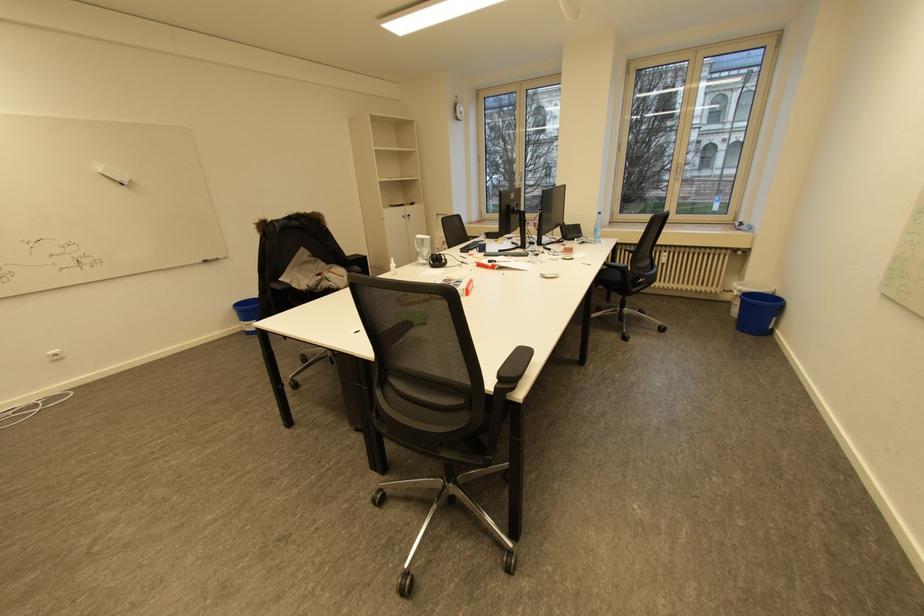
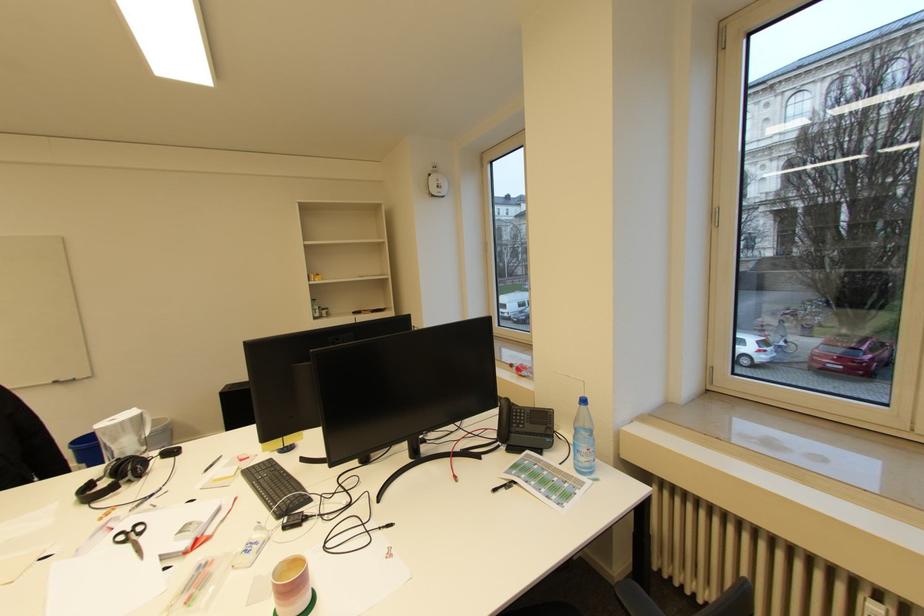
Find the pixel in the second image that matches point 602,225 in the first image.

(581, 429)